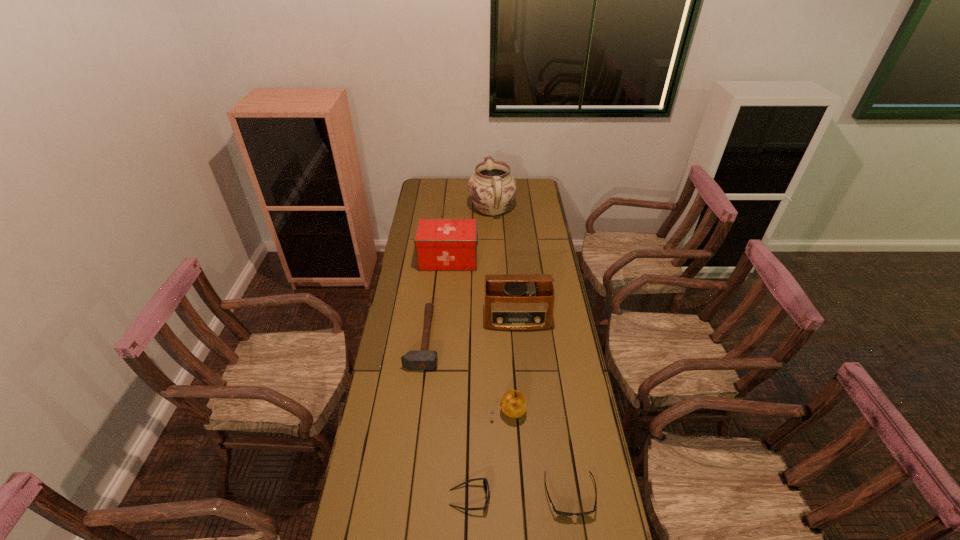
Identify the location of the shortest object. Image resolution: width=960 pixels, height=540 pixels. (560, 513).

This screenshot has height=540, width=960. In order to click on free space located 0.060m on the spout of the farthest object in this screenshot , I will do `click(492, 190)`.

The height and width of the screenshot is (540, 960). In order to click on free region located on the spout of the farthest object in this screenshot , I will do `click(492, 188)`.

Image resolution: width=960 pixels, height=540 pixels. I want to click on vacant point located on the front panel of the radio receiver, so click(525, 412).

Find the location of a particular element. The height and width of the screenshot is (540, 960). vacant space situated on the handle side of the second farthest object is located at coordinates (505, 260).

Where is `free region located on the front of the fourth tallest object`? free region located on the front of the fourth tallest object is located at coordinates (511, 461).

Where is `vacant space located 0.090m on the striking surface of the fifth tallest object`? The height and width of the screenshot is (540, 960). vacant space located 0.090m on the striking surface of the fifth tallest object is located at coordinates pyautogui.click(x=463, y=339).

Locate an element on the screen. vacant position located 0.090m on the front-facing side of the left sunglasses is located at coordinates (520, 497).

Where is `object that is positioned at the far edge`? This screenshot has height=540, width=960. object that is positioned at the far edge is located at coordinates (492, 188).

I want to click on the first-aid kit located at the left edge, so click(441, 244).